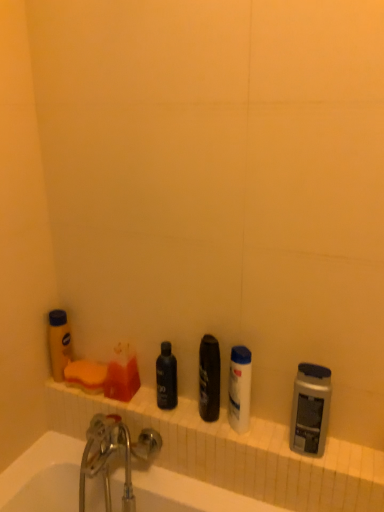
The image size is (384, 512). Identify the location of vacant space situated on the left part of metallic gray shaver at right, the first toiletry in the right-to-left sequence. (257, 438).